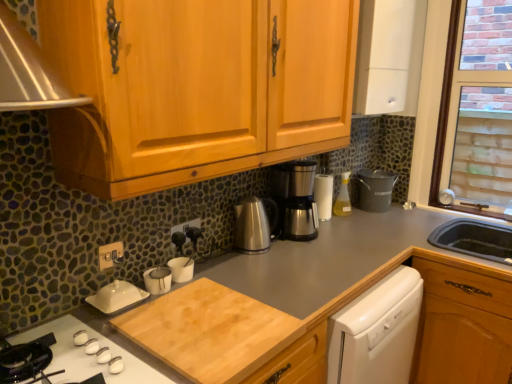
This screenshot has width=512, height=384. Identify the location of vacant area situated below white glossy gas stove at lower left (from a real-world perspective). (66, 353).